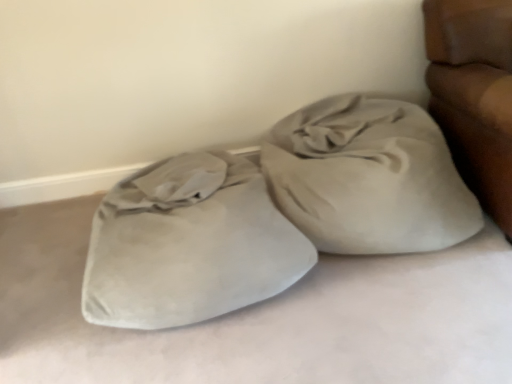
Question: Visually, is suede-like beige sack at center-right positioned to the left or to the right of suede-like beige sleeping bag at lower left?

Choices:
 (A) right
 (B) left

Answer: (A)

Question: Considering their positions, is suede-like beige sack at center-right located in front of or behind suede-like beige sleeping bag at lower left?

Choices:
 (A) behind
 (B) front

Answer: (A)

Question: From their relative heights in the image, would you say suede-like beige sack at center-right is taller or shorter than suede-like beige sleeping bag at lower left?

Choices:
 (A) tall
 (B) short

Answer: (A)

Question: Is suede-like beige sleeping bag at lower left in front of or behind suede-like beige sack at center-right in the image?

Choices:
 (A) behind
 (B) front

Answer: (B)

Question: Is suede-like beige sleeping bag at lower left situated inside suede-like beige sack at center-right or outside?

Choices:
 (A) outside
 (B) inside

Answer: (A)

Question: Is suede-like beige sleeping bag at lower left wider or thinner than suede-like beige sack at center-right?

Choices:
 (A) thin
 (B) wide

Answer: (B)

Question: In the image, is suede-like beige sleeping bag at lower left on the left side or the right side of suede-like beige sack at center-right?

Choices:
 (A) right
 (B) left

Answer: (B)